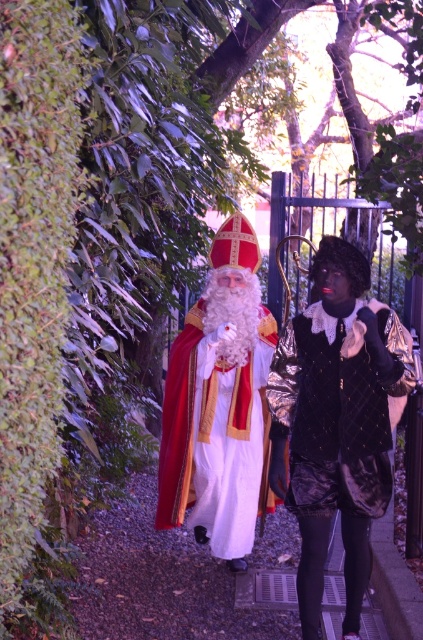
You are a photographer trying to capture a clear photo of the shiny black vest at center and the pebble gravel pavement at center. Which object will appear more detailed in the photo?

The shiny black vest at center will appear more detailed in the photo because it is thinner than the pebble gravel pavement at center, making it easier to focus on.

You are a photographer trying to capture the reflection of the shiny black vest at center in the pebble gravel pavement at center. Is this possible given their positions?

The shiny black vest at center is located above the pebble gravel pavement at center, so its reflection would be visible on the pavement if the surface is smooth enough and lighting conditions allow.